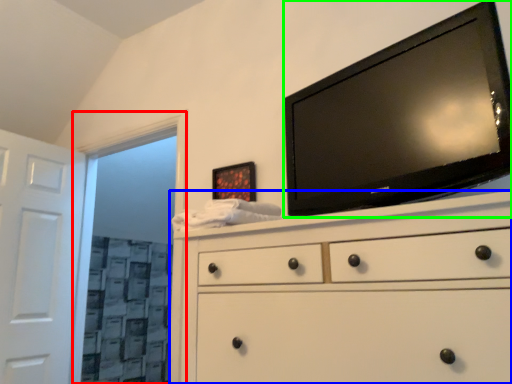
Question: Estimate the real-world distances between objects in this image. Which object is farther from glass door (highlighted by a red box), chest of drawers (highlighted by a blue box) or television (highlighted by a green box)?

Choices:
 (A) chest of drawers
 (B) television

Answer: (A)